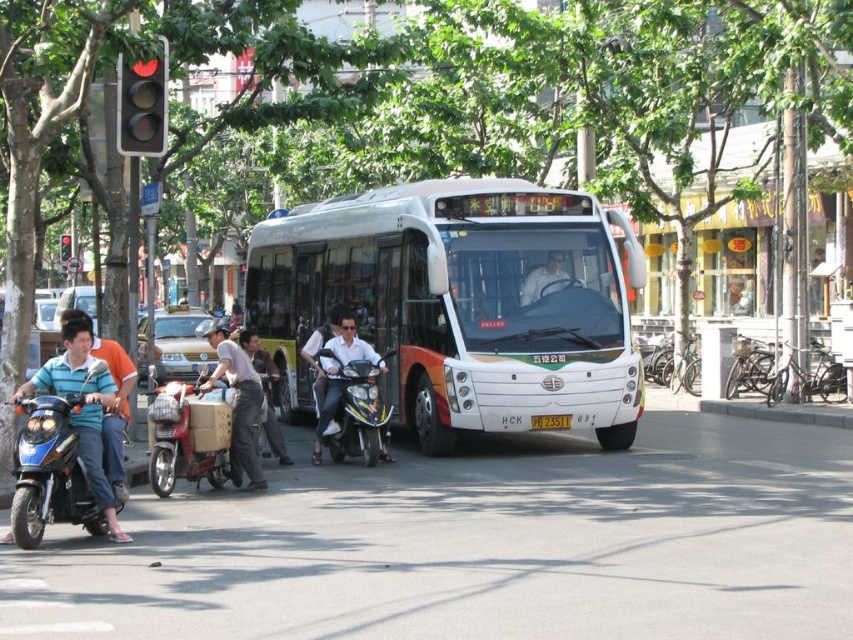
Consider the image. Can you confirm if light brown fabric shirt at center is thinner than red glass traffic light at upper left?

In fact, light brown fabric shirt at center might be wider than red glass traffic light at upper left.

This screenshot has width=853, height=640. In order to click on light brown fabric shirt at center in this screenshot , I will do `click(236, 401)`.

Is point (247, 464) positioned after point (135, 108)?

That is False.

Image resolution: width=853 pixels, height=640 pixels. Identify the location of light brown fabric shirt at center. (236, 401).

Who is more distant from viewer, (x=115, y=502) or (x=218, y=368)?

Positioned behind is point (x=218, y=368).

Can you confirm if shiny blue motorcycle at left is positioned to the left of light brown fabric shirt at center?

No, shiny blue motorcycle at left is not to the left of light brown fabric shirt at center.

Between point (70, 401) and point (231, 438), which one is positioned behind?

The point (231, 438) is more distant.

Locate an element on the screen. shiny blue motorcycle at left is located at coordinates (62, 451).

Is metallic red motorcycle at center-left shorter than blue denim jeans at left?

Correct, metallic red motorcycle at center-left is not as tall as blue denim jeans at left.

Is point (178, 444) behind point (107, 420)?

Yes, it is behind point (107, 420).

Does point (175, 438) come closer to viewer compared to point (115, 493)?

No, it is behind (115, 493).

Find the location of a particular element. The height and width of the screenshot is (640, 853). metallic red motorcycle at center-left is located at coordinates (189, 436).